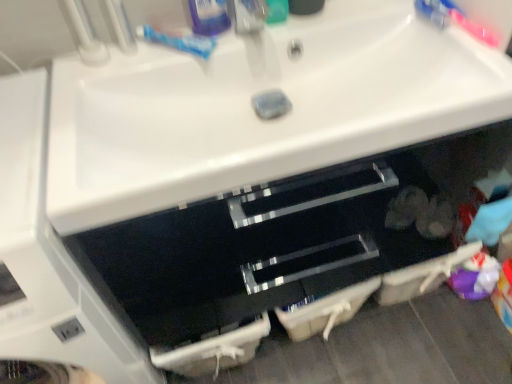
Where is `free region on the left part of green plastic toothpaste tube at upper center, the 1th toiletry in the right-to-left sequence`? free region on the left part of green plastic toothpaste tube at upper center, the 1th toiletry in the right-to-left sequence is located at coordinates (222, 39).